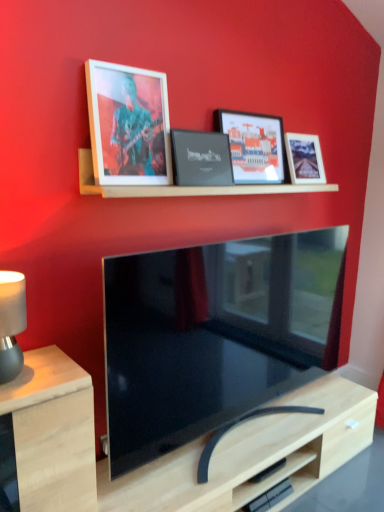
Question: Does matte black picture frame at upper center, arranged as the second picture frame when viewed from the right, have a lesser width compared to matte black lampshade at left?

Choices:
 (A) no
 (B) yes

Answer: (B)

Question: Does matte black picture frame at upper center, arranged as the second picture frame when viewed from the right, contain matte black lampshade at left?

Choices:
 (A) yes
 (B) no

Answer: (B)

Question: From the image's perspective, is matte black picture frame at upper center, arranged as the second picture frame when viewed from the right, above matte black lampshade at left?

Choices:
 (A) yes
 (B) no

Answer: (A)

Question: Can you confirm if matte black picture frame at upper center, positioned as the third picture frame in left-to-right order, is wider than matte black lampshade at left?

Choices:
 (A) no
 (B) yes

Answer: (A)

Question: Does matte black picture frame at upper center, positioned as the third picture frame in left-to-right order, have a lesser height compared to matte black lampshade at left?

Choices:
 (A) no
 (B) yes

Answer: (A)

Question: From the image's perspective, is matte black lampshade at left above or below light wood table at lower left?

Choices:
 (A) above
 (B) below

Answer: (A)

Question: Considering the positions of matte black lampshade at left and light wood table at lower left in the image, is matte black lampshade at left bigger or smaller than light wood table at lower left?

Choices:
 (A) small
 (B) big

Answer: (A)

Question: Is matte black lampshade at left spatially inside light wood table at lower left, or outside of it?

Choices:
 (A) outside
 (B) inside

Answer: (A)

Question: Considering the positions of point (16, 271) and point (69, 389), is point (16, 271) closer or farther from the camera than point (69, 389)?

Choices:
 (A) farther
 (B) closer

Answer: (A)

Question: Would you say matte black picture frame at upper center, arranged as the second picture frame when viewed from the right, is inside or outside light wood table at lower left?

Choices:
 (A) outside
 (B) inside

Answer: (A)

Question: Considering the positions of matte black picture frame at upper center, positioned as the third picture frame in left-to-right order, and light wood table at lower left in the image, is matte black picture frame at upper center, positioned as the third picture frame in left-to-right order, taller or shorter than light wood table at lower left?

Choices:
 (A) short
 (B) tall

Answer: (A)

Question: In the image, is matte black picture frame at upper center, arranged as the second picture frame when viewed from the right, positioned in front of or behind light wood table at lower left?

Choices:
 (A) behind
 (B) front

Answer: (A)

Question: Looking at the image, does matte black picture frame at upper center, arranged as the second picture frame when viewed from the right, seem bigger or smaller compared to light wood table at lower left?

Choices:
 (A) big
 (B) small

Answer: (B)

Question: Is point (102, 167) positioned closer to the camera than point (180, 137)?

Choices:
 (A) farther
 (B) closer

Answer: (B)

Question: Is matte wooden picture frame at upper left, positioned as the 4th picture frame in right-to-left order, taller or shorter than black matte picture frame at center, placed as the third picture frame when sorted from right to left?

Choices:
 (A) short
 (B) tall

Answer: (B)